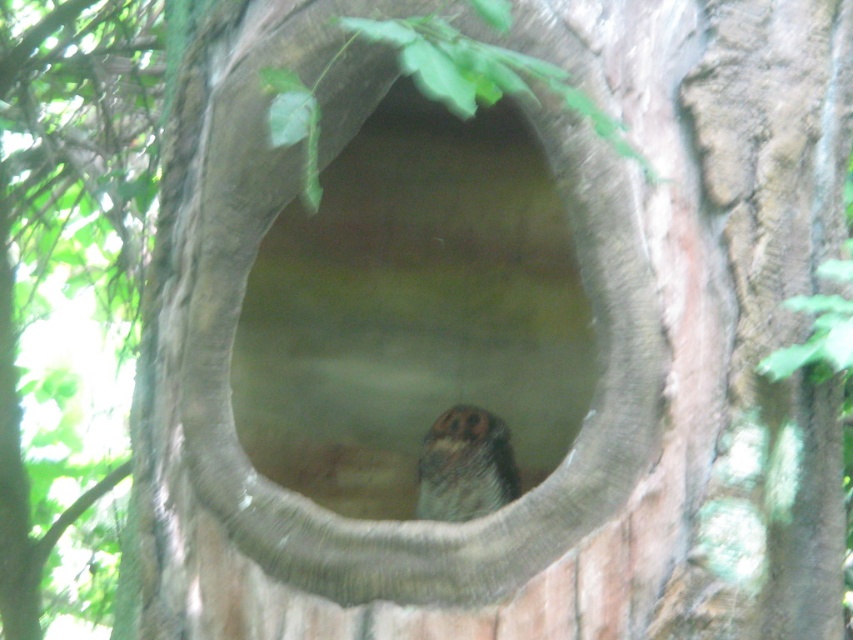
Is smooth concrete hole at center wider than brown speckled owl at center?

Indeed, smooth concrete hole at center has a greater width compared to brown speckled owl at center.

Is smooth concrete hole at center below brown speckled owl at center?

No.

Where is `smooth concrete hole at center`? This screenshot has width=853, height=640. smooth concrete hole at center is located at coordinates (415, 312).